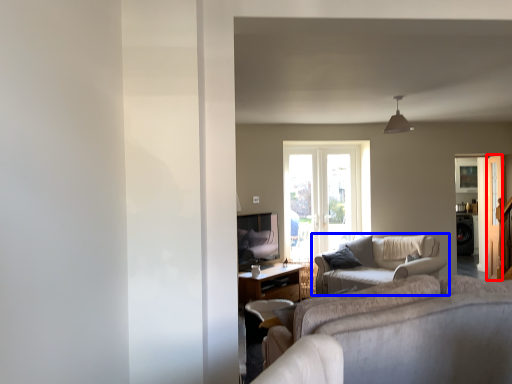
Question: Among these objects, which one is farthest to the camera, screen door (highlighted by a red box) or studio couch (highlighted by a blue box)?

Choices:
 (A) screen door
 (B) studio couch

Answer: (A)